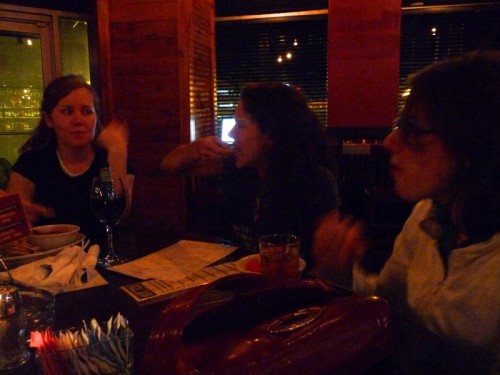
In order to click on window in this screenshot , I will do pyautogui.click(x=237, y=42).